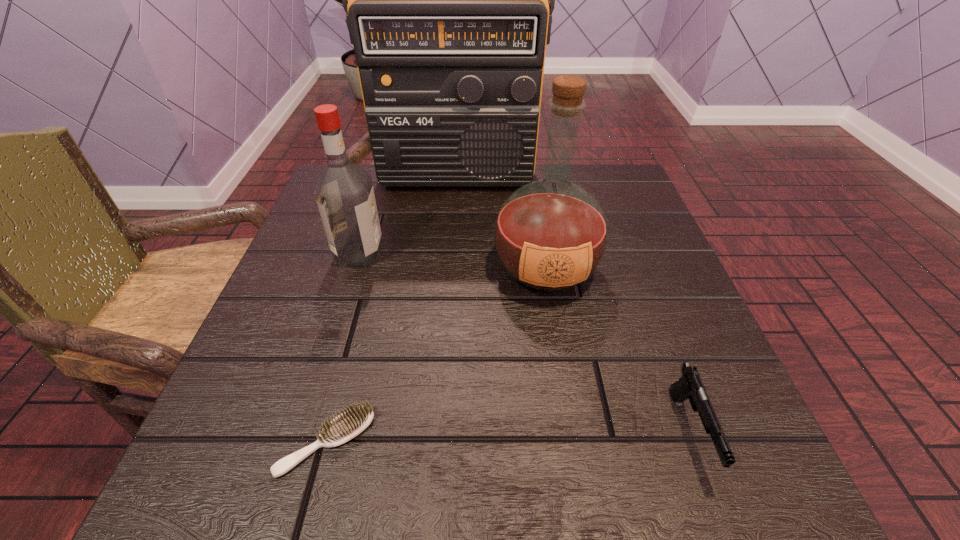
Identify the location of free space located 0.300m on the front-facing side of the left liquor. (533, 253).

Find the location of a particular element. Image resolution: width=960 pixels, height=540 pixels. vacant area situated 0.270m on the right of the shortest object is located at coordinates (573, 442).

This screenshot has height=540, width=960. I want to click on object that is at the far edge, so click(x=446, y=0).

Where is `gun that is at the near edge`? gun that is at the near edge is located at coordinates (690, 386).

You are a GUI agent. You are given a task and a screenshot of the screen. Output one action in this format:
    pyautogui.click(x=<x>, y=<y>)
    Task: Click on the scrubbing brush that is at the near edge
    
    Given the screenshot: What is the action you would take?
    pyautogui.click(x=349, y=424)

Where is `radio receiver positioned at the left edge`? The image size is (960, 540). radio receiver positioned at the left edge is located at coordinates (446, 0).

Image resolution: width=960 pixels, height=540 pixels. Identify the location of liquor at the left edge. (344, 193).

The height and width of the screenshot is (540, 960). In order to click on scrubbing brush present at the left edge in this screenshot , I will do `click(349, 424)`.

Locate an element on the screen. This screenshot has width=960, height=540. liquor positioned at the right edge is located at coordinates (550, 235).

Where is `gun that is at the right edge`? This screenshot has height=540, width=960. gun that is at the right edge is located at coordinates (690, 386).